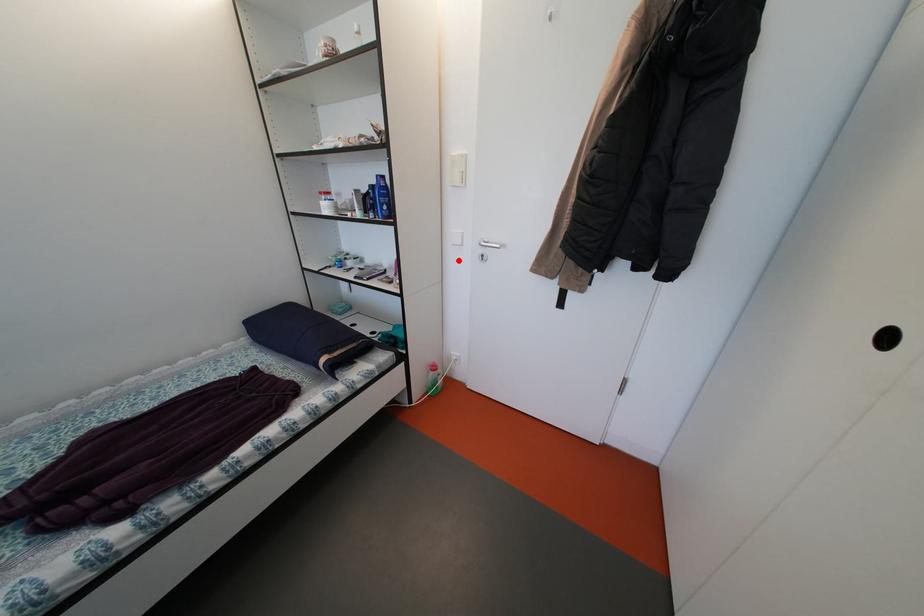
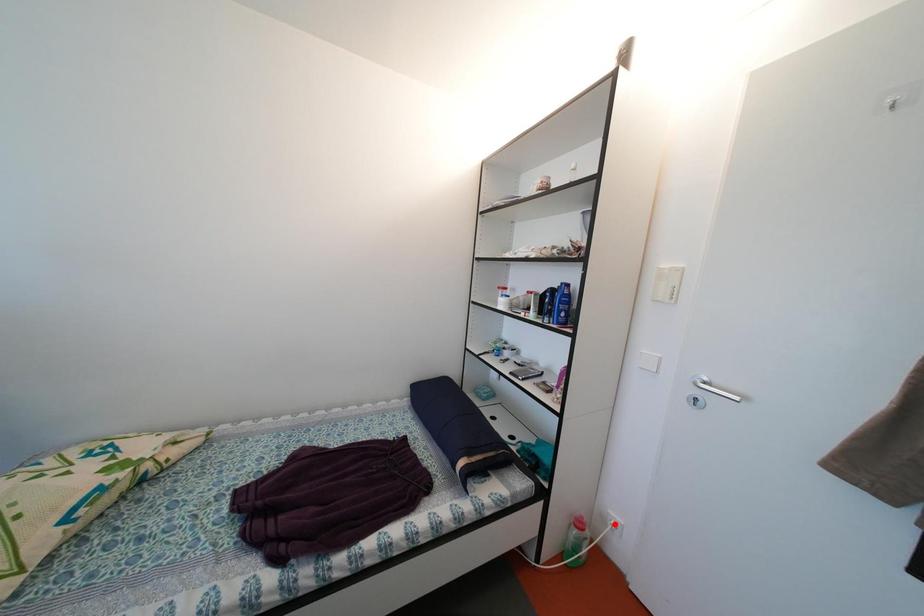
I am providing you with two images of the same scene from different viewpoints. A red point is marked on the first image and another point is marked on the second image. Is the red point in image1 aligned with the point shown in image2?

No